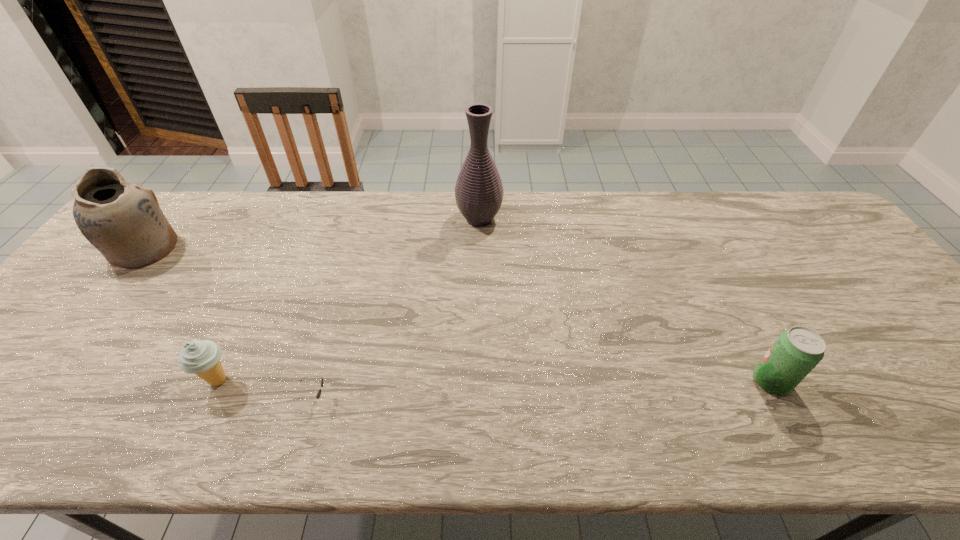
In order to click on vacant space at the left edge in this screenshot , I will do `click(7, 406)`.

Identify the location of vacant area at the right edge. (825, 273).

Locate an element on the screen. The image size is (960, 540). vacant space that's between the fourth object from left to right and the third object from right to left is located at coordinates (396, 309).

You are a GUI agent. You are given a task and a screenshot of the screen. Output one action in this format:
    pyautogui.click(x=<x>, y=<y>)
    Task: Click on the free space between the icecream and the sunglasses
    The height and width of the screenshot is (540, 960).
    Given the screenshot: What is the action you would take?
    pyautogui.click(x=266, y=389)

Where is `vacant region between the tallest object and the icecream`? Image resolution: width=960 pixels, height=540 pixels. vacant region between the tallest object and the icecream is located at coordinates (348, 300).

Find the location of a particular element. free space between the pottery and the third object from right to left is located at coordinates (229, 323).

Find the location of `vacant region between the second object from right to left and the shortest object`. vacant region between the second object from right to left and the shortest object is located at coordinates (396, 309).

Where is `vacant region between the sunglasses and the second tallest object`? The image size is (960, 540). vacant region between the sunglasses and the second tallest object is located at coordinates (229, 323).

Identify the location of empty space between the pottery and the third object from right to left. (229, 323).

The height and width of the screenshot is (540, 960). Identify the location of vacant space that is in between the second object from right to left and the second tallest object. (312, 234).